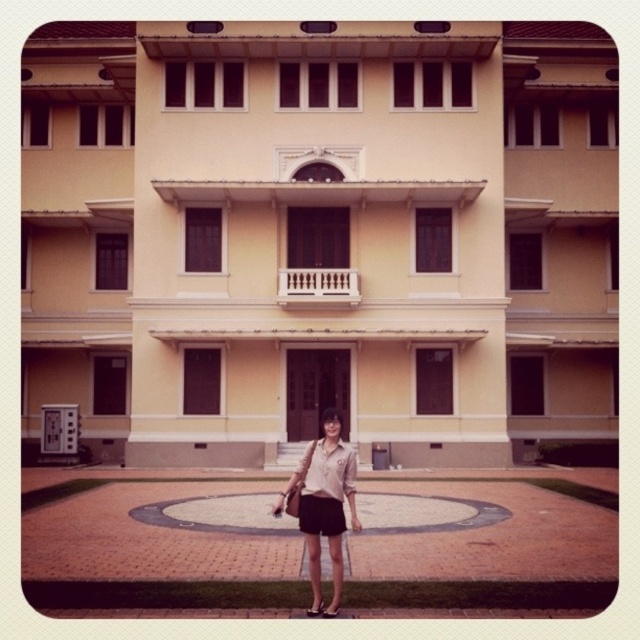
You are a fashion designer observing the scene and want to know which clothing item is larger between the matte beige blouse at center and the light beige fabric dress at center. Could you determine this based on the visual information provided?

The matte beige blouse at center is bigger than the light beige fabric dress at center according to the description.

Looking at this image, you are standing at the point closest to the building in the image. There are two points marked in the scene, point A at coordinates point A is point (298,484) and point B at coordinates point B is point (321,448). Which point is closer to you?

Point A at coordinates point A is point (298,484) is closer to you because it is in front of point B at coordinates point B is point (321,448).